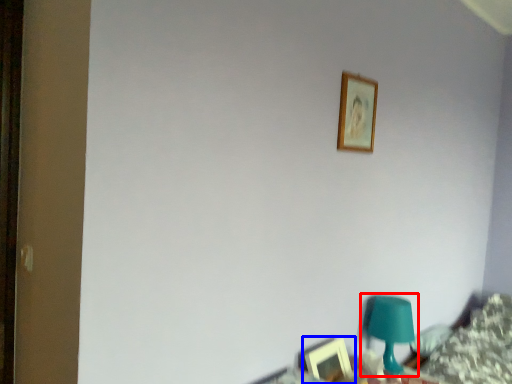
Question: Among these objects, which one is farthest to the camera, table lamp (highlighted by a red box) or picture frame (highlighted by a blue box)?

Choices:
 (A) table lamp
 (B) picture frame

Answer: (A)